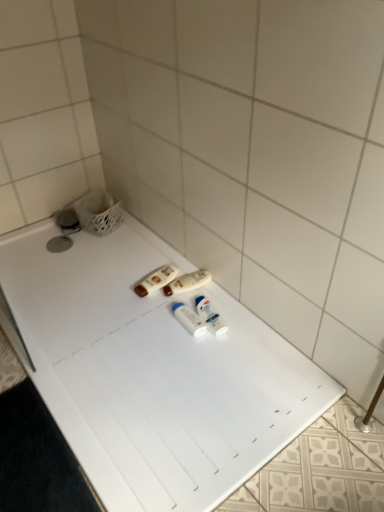
Locate an element on the screen. The image size is (384, 512). free space to the left of brown plastic lotion at center, the first toiletry in the left-to-right sequence is located at coordinates (114, 286).